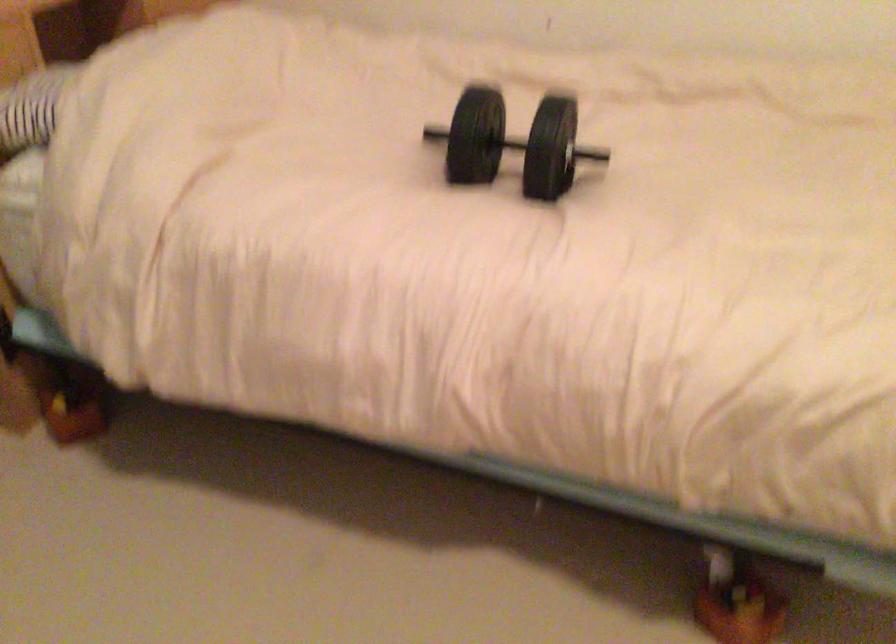
Where would you lift the black dumbbell handle? Please return your answer as a coordinate pair (x, y).

(513, 143)